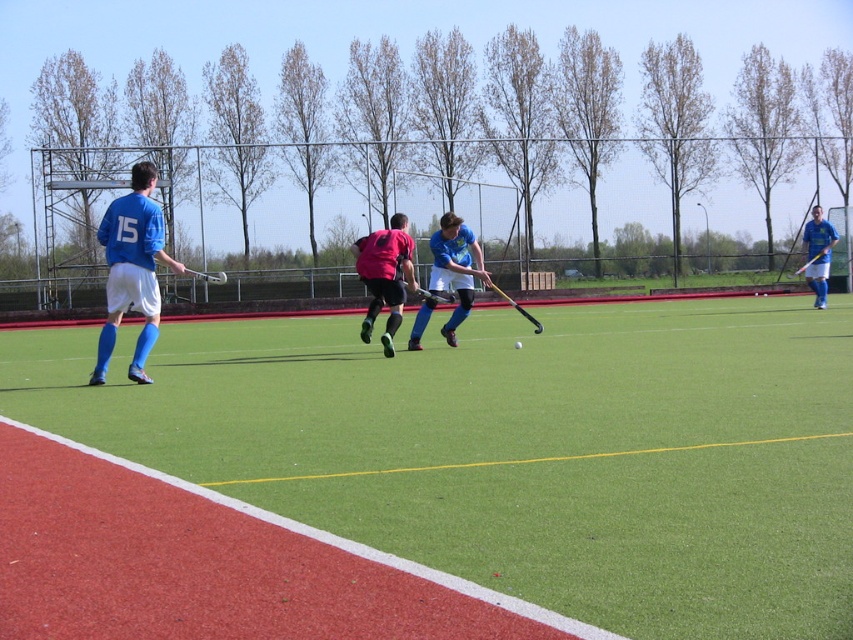
Which is behind, point (724, 600) or point (383, 285)?

Point (383, 285)

Looking at this image, is green artificial turf at center wider than matte pink jersey at center?

Yes.

Is point (491, 563) closer to viewer compared to point (404, 220)?

Yes, it is.

Where is `green artificial turf at center`? The image size is (853, 640). green artificial turf at center is located at coordinates (526, 451).

Which is below, matte blue jersey at left or matte pink jersey at center?

matte pink jersey at center is below.

Based on the photo, can you confirm if matte blue jersey at left is positioned to the left of matte pink jersey at center?

Indeed, matte blue jersey at left is positioned on the left side of matte pink jersey at center.

Locate an element on the screen. matte blue jersey at left is located at coordinates (132, 268).

Does green artificial turf at center appear over matte blue shirt at right?

Incorrect, green artificial turf at center is not positioned above matte blue shirt at right.

Is green artificial turf at center taller than matte blue shirt at right?

No.

Which is behind, point (656, 522) or point (819, 307)?

Positioned behind is point (819, 307).

Where is `green artificial turf at center`? This screenshot has height=640, width=853. green artificial turf at center is located at coordinates (526, 451).